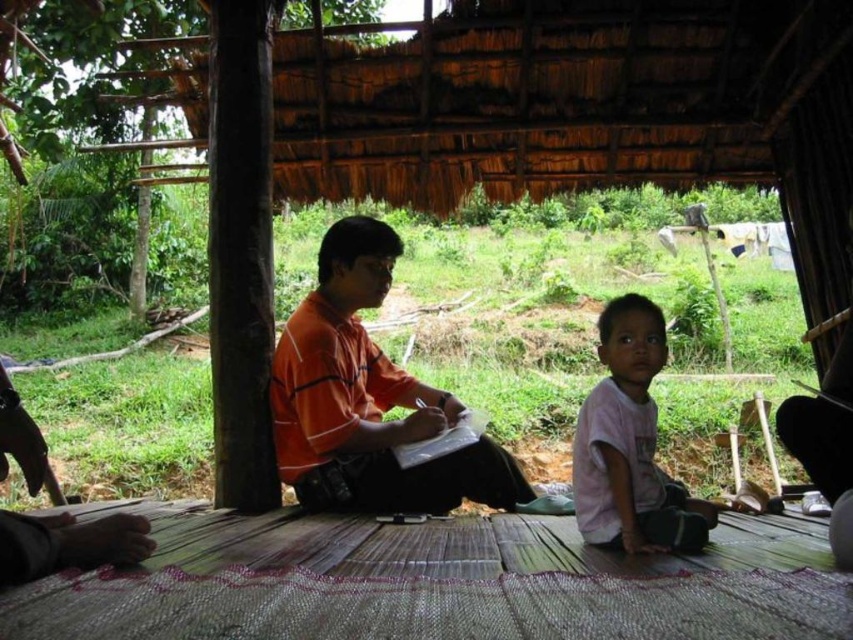
Can you confirm if orange fabric shirt at center is shorter than white cotton shirt at center?

Incorrect, orange fabric shirt at center's height does not fall short of white cotton shirt at center's.

In the scene shown: Is orange fabric shirt at center taller than white cotton shirt at center?

Yes, orange fabric shirt at center is taller than white cotton shirt at center.

Describe the element at coordinates (368, 400) in the screenshot. Image resolution: width=853 pixels, height=640 pixels. I see `orange fabric shirt at center` at that location.

Locate an element on the screen. The width and height of the screenshot is (853, 640). orange fabric shirt at center is located at coordinates (368, 400).